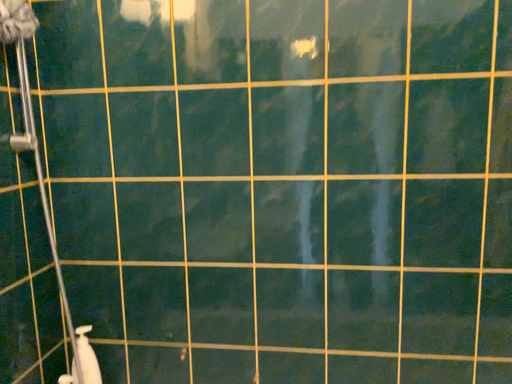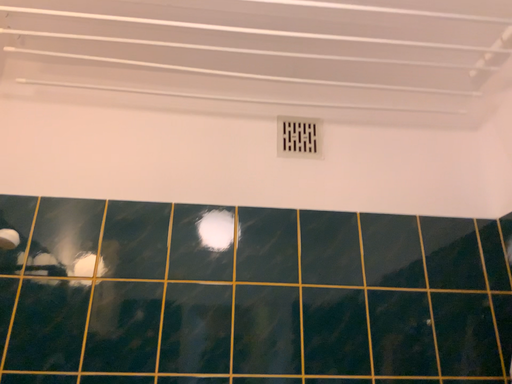
Question: Which way did the camera rotate in the video?

Choices:
 (A) rotated downward
 (B) rotated upward

Answer: (B)